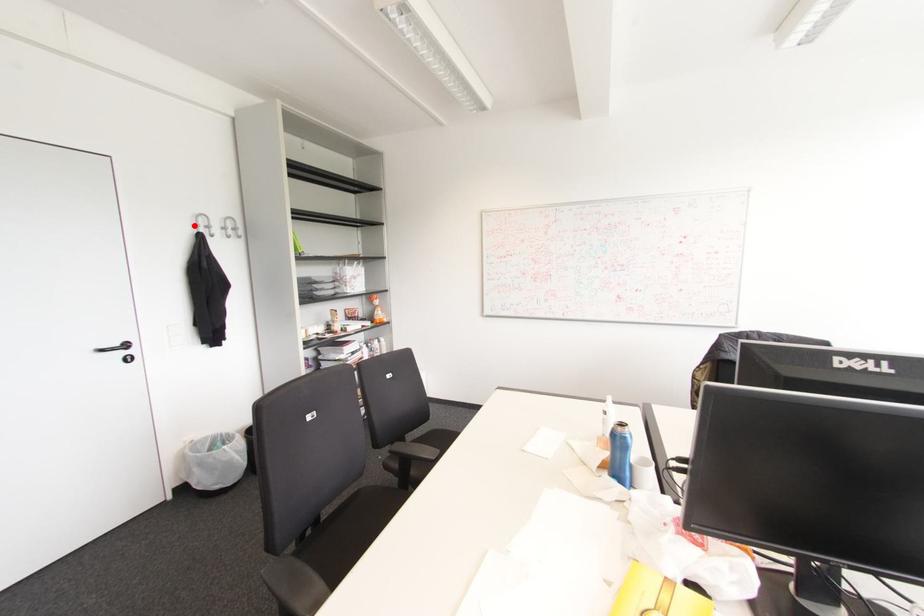
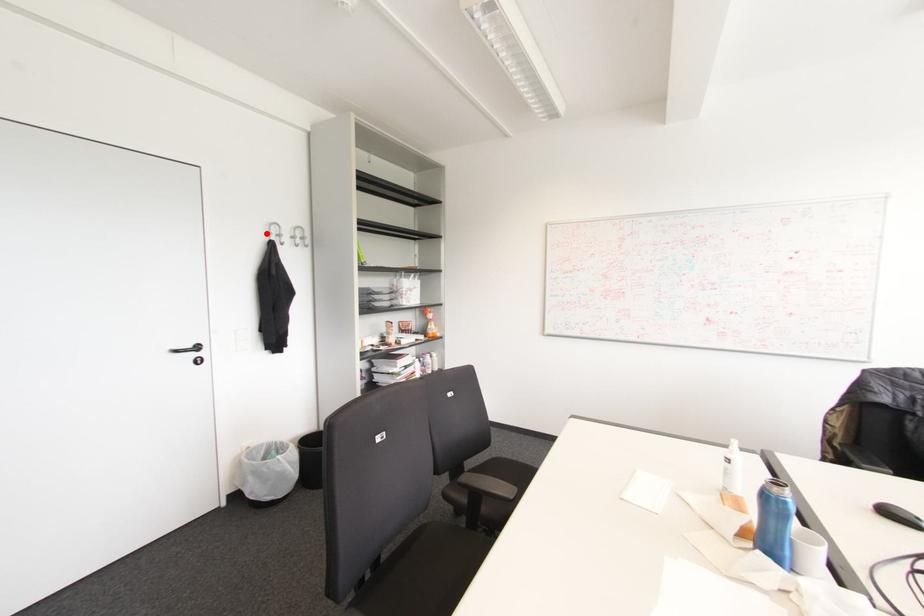
In the scene shown: I am providing you with two images of the same scene from different viewpoints. A red point is marked on the first image and another point is marked on the second image. Is the marked point in image1 the same physical position as the marked point in image2?

Yes